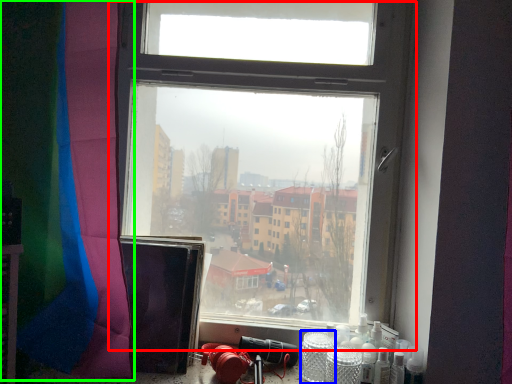
Question: Considering the real-world distances, which object is closest to window (highlighted by a red box)? glass jar (highlighted by a blue box) or curtain (highlighted by a green box).

Choices:
 (A) glass jar
 (B) curtain

Answer: (B)